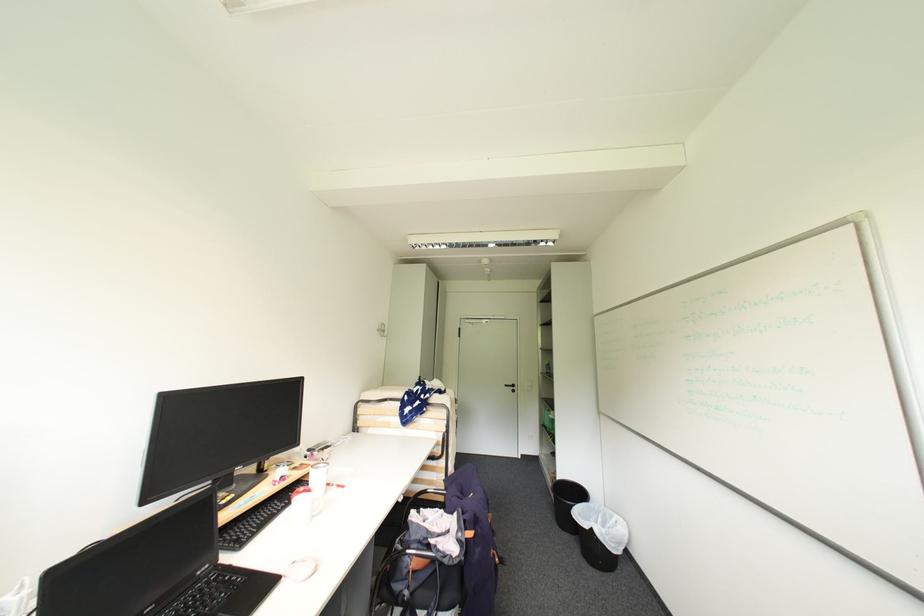
The width and height of the screenshot is (924, 616). I want to click on white cylindrical can, so click(301, 506).